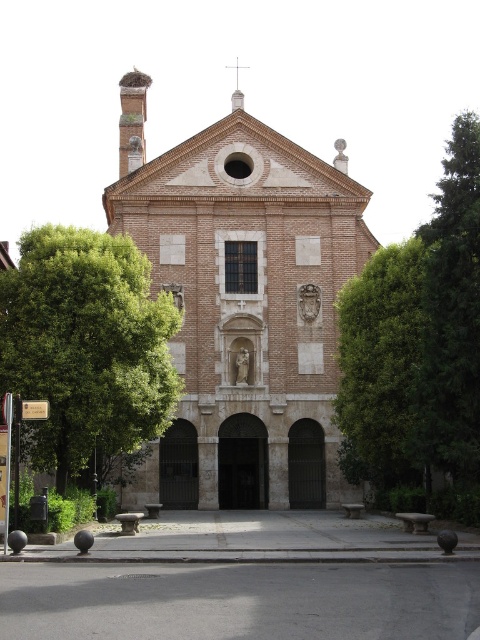
You are a visitor standing in front of the historic church. You notice the brown brick chapel at center and the green leafy tree at right. Which object appears taller in the scene?

The brown brick chapel at center is taller than the green leafy tree at right.

You are standing in front of the historic church building and want to take a photo of the central entrance. To avoid the green leafy tree at right from blocking the view, where should you position yourself relative to the tree?

The green leafy tree at right is located at point (418, 353), so you should position yourself to the left side of the tree to avoid it blocking the view of the central entrance.